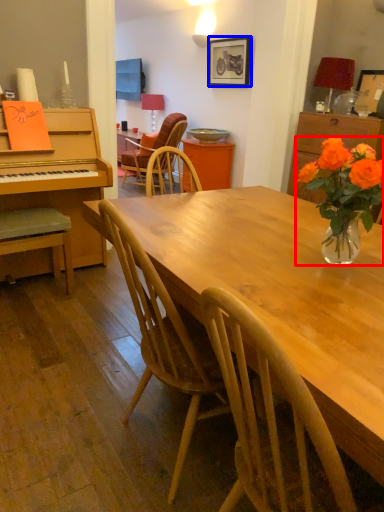
Question: Which point is further to the camera, houseplant (highlighted by a red box) or picture frame (highlighted by a blue box)?

Choices:
 (A) houseplant
 (B) picture frame

Answer: (B)